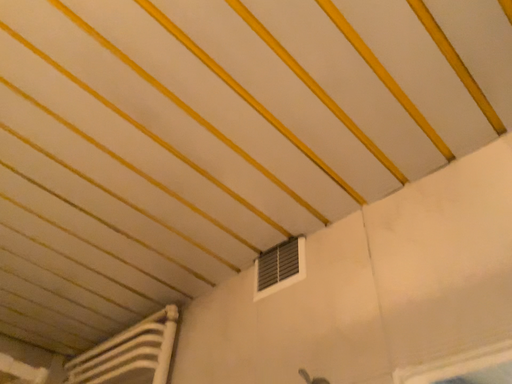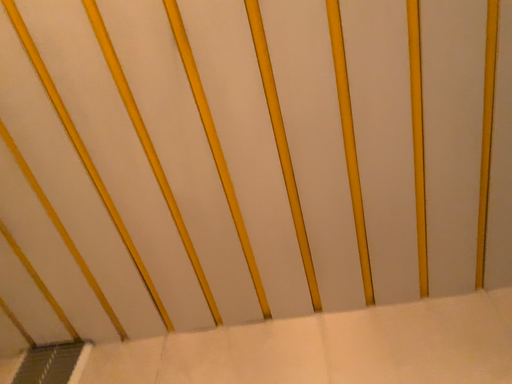
Question: Which way did the camera rotate in the video?

Choices:
 (A) rotated downward
 (B) rotated upward

Answer: (B)